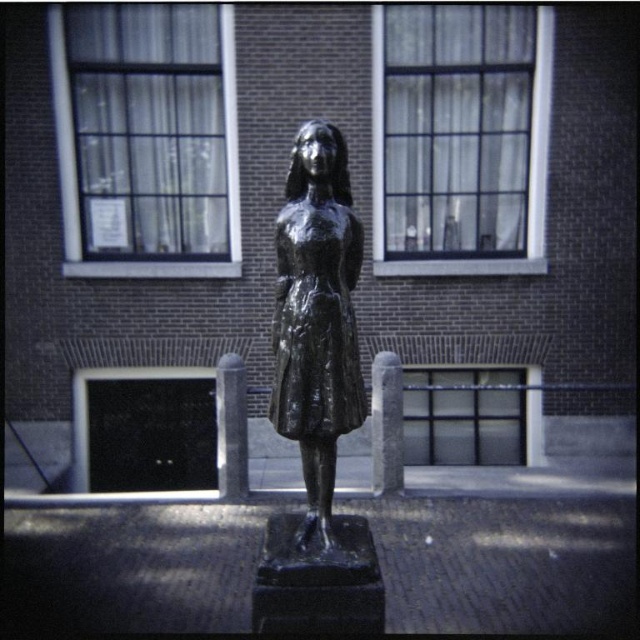
Between bronze statue at center and shiny black dress at center, which one appears on the right side from the viewer's perspective?

From the viewer's perspective, shiny black dress at center appears more on the right side.

Describe the element at coordinates (316, 316) in the screenshot. This screenshot has height=640, width=640. I see `bronze statue at center` at that location.

Locate an element on the screen. The width and height of the screenshot is (640, 640). bronze statue at center is located at coordinates (316, 316).

I want to click on bronze statue at center, so click(316, 316).